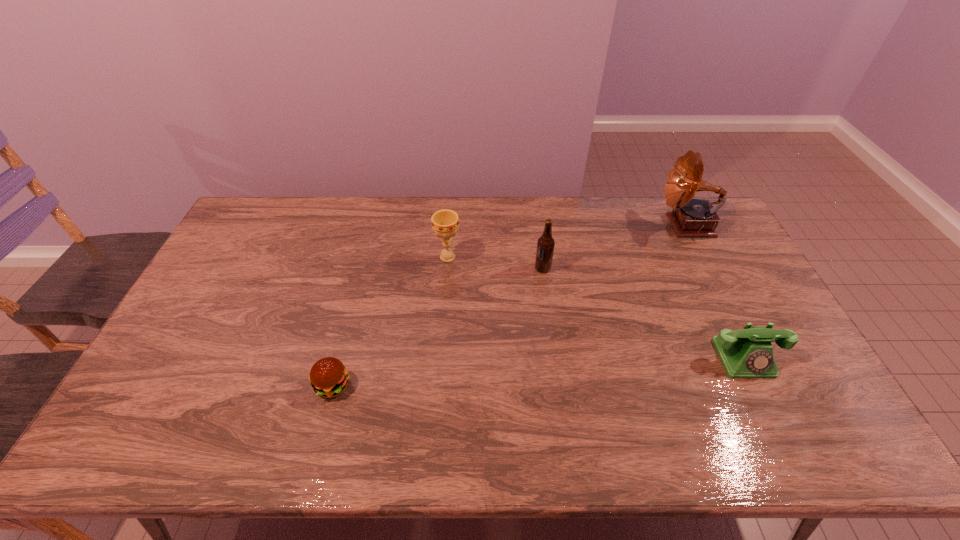
This screenshot has width=960, height=540. Find the location of `telephone that is positioned at the right edge`. telephone that is positioned at the right edge is located at coordinates (748, 353).

Image resolution: width=960 pixels, height=540 pixels. In order to click on object that is at the far right corner in this screenshot , I will do point(692,217).

In the image, there is a desktop. Identify the location of vacant region at the far edge. (461, 210).

The image size is (960, 540). Find the location of `free space at the near edge`. free space at the near edge is located at coordinates (394, 435).

This screenshot has width=960, height=540. I want to click on vacant space at the left edge, so click(x=210, y=362).

Locate an element on the screen. free spot at the far left corner of the desktop is located at coordinates (274, 213).

Identify the location of free space that is in between the telephone and the phonograph_record. (715, 292).

Where is `vacant space that is in between the chalice and the third object from right to left`? vacant space that is in between the chalice and the third object from right to left is located at coordinates (495, 263).

Locate an element on the screen. vacant area that lies between the third object from left to right and the tallest object is located at coordinates (614, 247).

Identify the location of vacant space in between the beer bottle and the third shortest object. (495, 263).